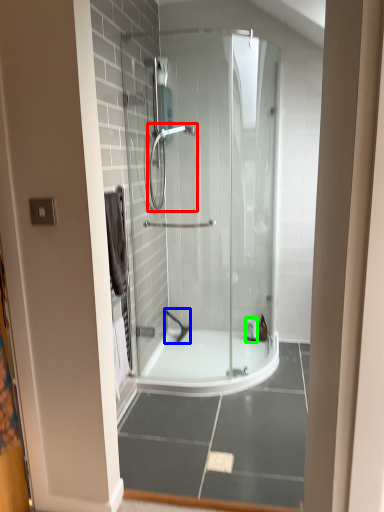
Question: Which object is the farthest from shower (highlighted by a red box)? Choose among these: shower (highlighted by a blue box) or toiletry (highlighted by a green box).

Choices:
 (A) shower
 (B) toiletry

Answer: (B)